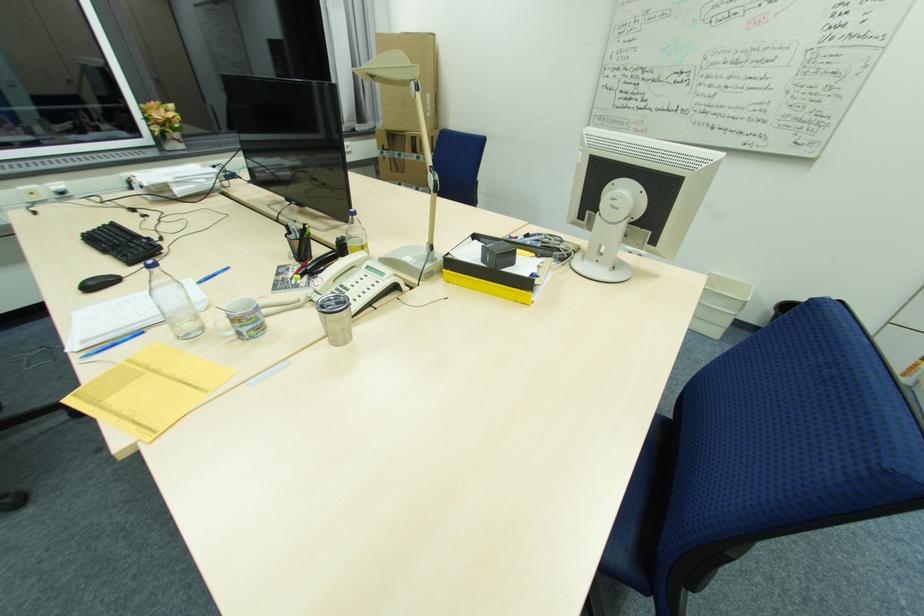
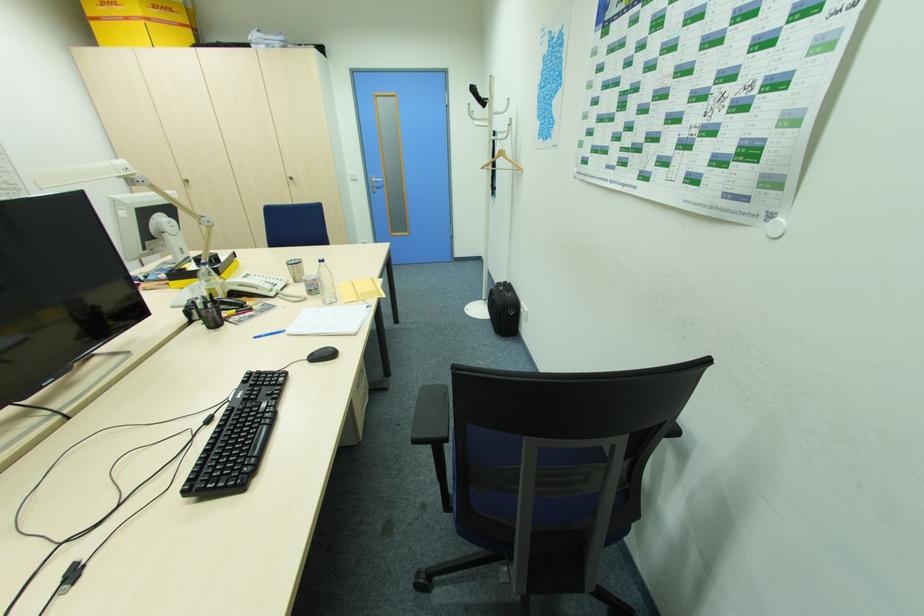
Find the pixel in the second image that matches point 157,270 in the first image.

(324, 264)